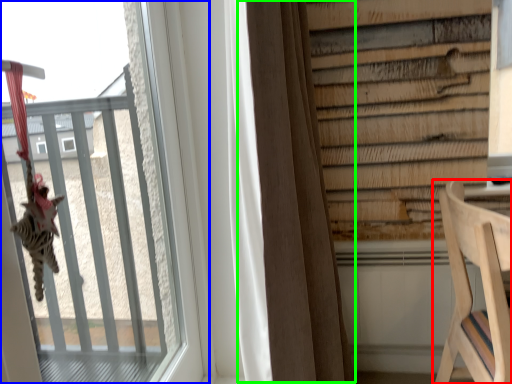
Question: Considering the real-world distances, which object is farthest from furniture (highlighted by a red box)? window (highlighted by a blue box) or curtain (highlighted by a green box)?

Choices:
 (A) window
 (B) curtain

Answer: (A)